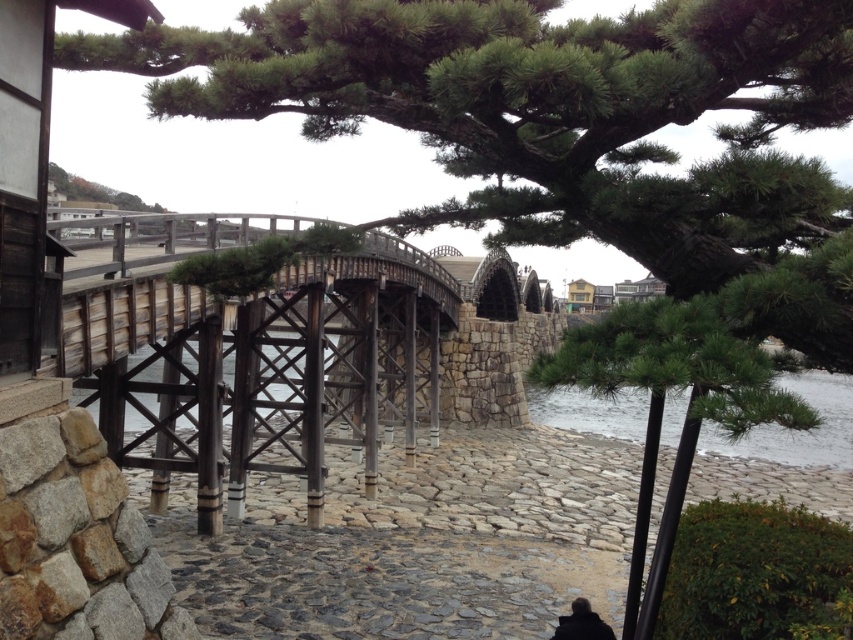
You are standing on the traditional wooden bridge and looking down. You see the clear water at lower right and the black matte person at lower right. Which object is closer to you?

The clear water at lower right is closer to you because it is in front of the black matte person at lower right.